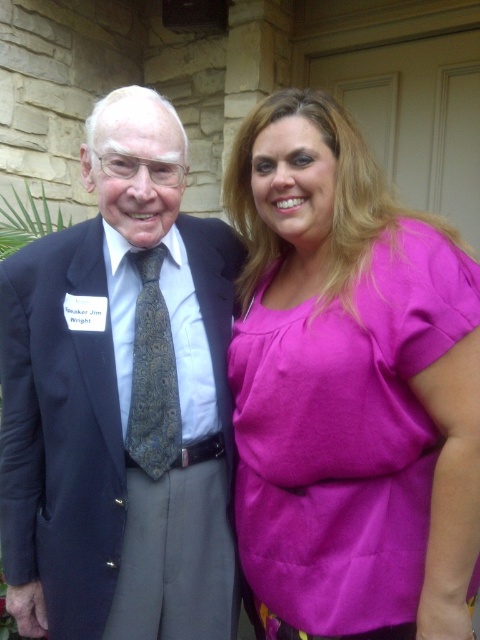
You are a photographer at an event and need to ensure that both the pink fabric blouse at right and the matte black suit at left are visible in the photo. Given their sizes, which one might require you to adjust your camera angle to capture details without overcrowding the frame?

The pink fabric blouse at right is larger in size than the matte black suit at left, so you may need to adjust your camera angle to focus on the pink fabric blouse at right to avoid overcrowding the frame.

You are taking a photo of two people standing outdoors. You notice two points in the image at coordinates point (224, 301) and point (160, 474). Which point is closer to the camera?

Point (224, 301) is further to the camera than point (160, 474), so the point closer to the camera is point (160, 474).

You are standing at the point labeled as point (159,371) in the image. You want to greet the Speaker Jim Wright. Can you reach him without moving from your current position?

The distance between you and the Speaker Jim Wright is 1.29 meters, so you can reach him without moving from your current position as the distance is manageable for a greeting.